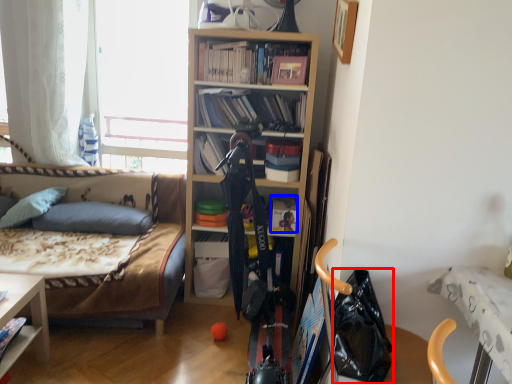
Question: Which point is closer to the camera, handbag (highlighted by a red box) or book (highlighted by a blue box)?

Choices:
 (A) handbag
 (B) book

Answer: (A)